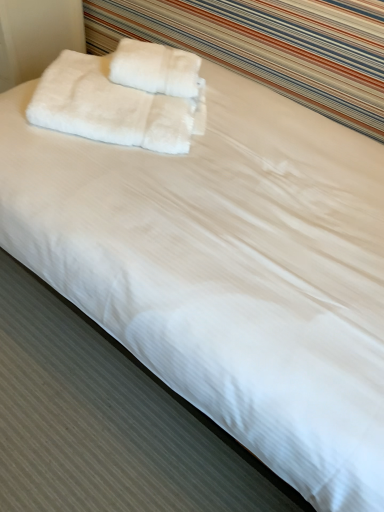
Question: Which direction should I rotate to look at white fluffy towel at upper center, the 1th towel positioned from the right, — up or down?

Choices:
 (A) up
 (B) down

Answer: (A)

Question: From the image's perspective, is white fluffy towel at upper center, the 2th towel viewed from the left, under white fluffy towels at upper left, the second towel viewed from the right?

Choices:
 (A) no
 (B) yes

Answer: (A)

Question: Is white fluffy towel at upper center, the 2th towel viewed from the left, taller than white fluffy towels at upper left, the second towel viewed from the right?

Choices:
 (A) yes
 (B) no

Answer: (B)

Question: Is white fluffy towel at upper center, the 1th towel positioned from the right, surrounding white fluffy towels at upper left, which is the 1th towel from left to right?

Choices:
 (A) no
 (B) yes

Answer: (A)

Question: From the image's perspective, does white fluffy towel at upper center, the 2th towel viewed from the left, appear higher than white fluffy towels at upper left, the second towel viewed from the right?

Choices:
 (A) yes
 (B) no

Answer: (A)

Question: Does white fluffy towel at upper center, the 1th towel positioned from the right, appear on the right side of white fluffy towels at upper left, the second towel viewed from the right?

Choices:
 (A) no
 (B) yes

Answer: (B)

Question: Can you confirm if white fluffy towel at upper center, the 2th towel viewed from the left, is smaller than white fluffy towels at upper left, the second towel viewed from the right?

Choices:
 (A) no
 (B) yes

Answer: (B)

Question: Is white fluffy towels at upper left, the second towel viewed from the right, to the left of white fluffy towel at upper center, the 2th towel viewed from the left, from the viewer's perspective?

Choices:
 (A) yes
 (B) no

Answer: (A)

Question: Can you confirm if white fluffy towels at upper left, the second towel viewed from the right, is positioned to the right of white fluffy towel at upper center, the 2th towel viewed from the left?

Choices:
 (A) no
 (B) yes

Answer: (A)

Question: Can you confirm if white fluffy towels at upper left, the second towel viewed from the right, is taller than white fluffy towel at upper center, the 2th towel viewed from the left?

Choices:
 (A) yes
 (B) no

Answer: (A)

Question: Is the surface of white fluffy towels at upper left, which is the 1th towel from left to right, in direct contact with white fluffy towel at upper center, the 1th towel positioned from the right?

Choices:
 (A) no
 (B) yes

Answer: (B)

Question: Does white fluffy towels at upper left, the second towel viewed from the right, have a smaller size compared to white fluffy towel at upper center, the 1th towel positioned from the right?

Choices:
 (A) no
 (B) yes

Answer: (A)

Question: Is white fluffy towels at upper left, which is the 1th towel from left to right, not near white fluffy towel at upper center, the 2th towel viewed from the left?

Choices:
 (A) yes
 (B) no

Answer: (B)

Question: Is point (82, 114) positioned closer to the camera than point (142, 74)?

Choices:
 (A) farther
 (B) closer

Answer: (B)